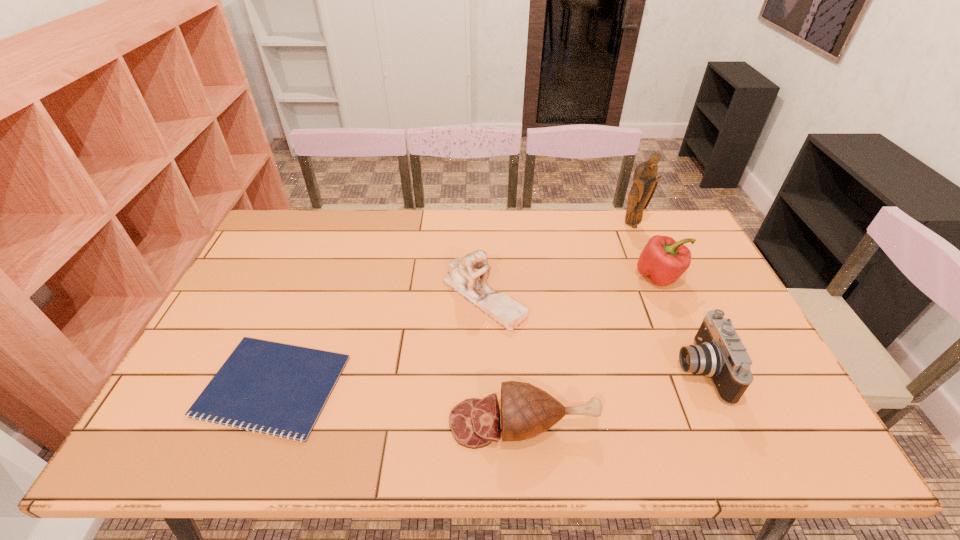
Identify the location of vacant space at the right edge. (770, 415).

Identify the location of vacant space at the far right corner of the desktop. (657, 210).

You are a GUI agent. You are given a task and a screenshot of the screen. Output one action in this format:
    pyautogui.click(x=<x>, y=<y>)
    Task: Click on the vacant region between the camera and the bell pepper
    
    Given the screenshot: What is the action you would take?
    pyautogui.click(x=680, y=323)

Find the location of a particular element. The image size is (960, 540). vacant area that lies between the shorter figurine and the notepad is located at coordinates (378, 341).

The image size is (960, 540). Identify the location of vacant space in between the right figurine and the shortest object. (452, 306).

Find the location of a particular element. This screenshot has height=540, width=960. vacant space that's between the camera and the right figurine is located at coordinates (666, 298).

Where is `free space between the camera and the shorter figurine`? The height and width of the screenshot is (540, 960). free space between the camera and the shorter figurine is located at coordinates (592, 333).

The width and height of the screenshot is (960, 540). In order to click on empty space that is in between the notepad and the second shortest object in this screenshot , I will do coord(398,404).

The height and width of the screenshot is (540, 960). What are the coordinates of `vacant space that's between the left figurine and the camera` in the screenshot? It's located at (592, 333).

Find the location of a particular element. Image resolution: width=960 pixels, height=540 pixels. unoccupied area between the camera and the bell pepper is located at coordinates (680, 323).